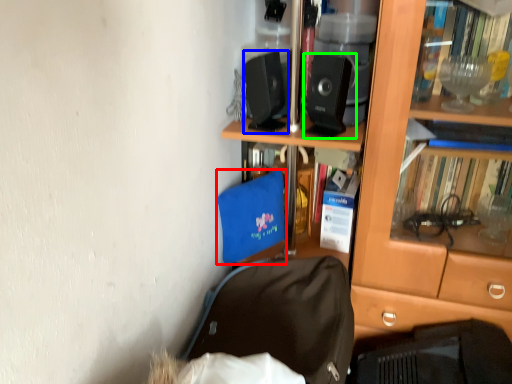
Question: Which is nearer to the luggage and bags (highlighted by a red box)? loudspeaker (highlighted by a blue box) or loudspeaker (highlighted by a green box).

Choices:
 (A) loudspeaker
 (B) loudspeaker

Answer: (A)